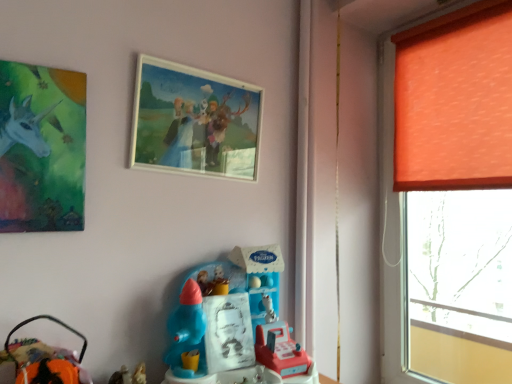
Question: From the image's perspective, is orange fabric curtain at right under velvet orange plush at lower left, which appears as the 1th toy when viewed from the left?

Choices:
 (A) no
 (B) yes

Answer: (A)

Question: From a real-world perspective, is orange fabric curtain at right physically below velvet orange plush at lower left, which appears as the 1th toy when viewed from the left?

Choices:
 (A) no
 (B) yes

Answer: (A)

Question: Can you confirm if orange fabric curtain at right is shorter than velvet orange plush at lower left, which appears as the 1th toy when viewed from the left?

Choices:
 (A) no
 (B) yes

Answer: (A)

Question: Does orange fabric curtain at right have a lesser width compared to velvet orange plush at lower left, which appears as the 1th toy when viewed from the left?

Choices:
 (A) no
 (B) yes

Answer: (B)

Question: Can you confirm if orange fabric curtain at right is bigger than velvet orange plush at lower left, positioned as the 2th toy in right-to-left order?

Choices:
 (A) no
 (B) yes

Answer: (B)

Question: Based on their positions, is matte green painting at upper left, which is counted as the 2th picture frame, starting from the right, located to the left or right of wooden picture frame at upper center, acting as the first picture frame starting from the back?

Choices:
 (A) left
 (B) right

Answer: (A)

Question: From their relative heights in the image, would you say matte green painting at upper left, which is counted as the 2th picture frame, starting from the right, is taller or shorter than wooden picture frame at upper center, acting as the first picture frame starting from the back?

Choices:
 (A) tall
 (B) short

Answer: (A)

Question: From a real-world perspective, relative to wooden picture frame at upper center, which ranks as the second picture frame in front-to-back order, is matte green painting at upper left, the first picture frame viewed from the left, vertically above or below?

Choices:
 (A) below
 (B) above

Answer: (A)

Question: Based on their sizes in the image, would you say matte green painting at upper left, placed as the 1th picture frame when sorted from front to back, is bigger or smaller than wooden picture frame at upper center, acting as the first picture frame starting from the back?

Choices:
 (A) small
 (B) big

Answer: (A)

Question: From the image's perspective, is plastic toy at center, marked as the 1th toy in a right-to-left arrangement, above or below orange fabric window at right?

Choices:
 (A) above
 (B) below

Answer: (B)

Question: Considering the positions of plastic toy at center, marked as the 1th toy in a right-to-left arrangement, and orange fabric window at right in the image, is plastic toy at center, marked as the 1th toy in a right-to-left arrangement, taller or shorter than orange fabric window at right?

Choices:
 (A) tall
 (B) short

Answer: (B)

Question: Does point (227, 269) appear closer or farther from the camera than point (468, 350)?

Choices:
 (A) farther
 (B) closer

Answer: (B)

Question: Choose the correct answer: Is plastic toy at center, marked as the 1th toy in a right-to-left arrangement, inside orange fabric window at right or outside it?

Choices:
 (A) inside
 (B) outside

Answer: (B)

Question: Looking at their shapes, would you say orange fabric curtain at right is wider or thinner than wooden picture frame at upper center, which ranks as the second picture frame in front-to-back order?

Choices:
 (A) wide
 (B) thin

Answer: (A)

Question: Would you say orange fabric curtain at right is inside or outside wooden picture frame at upper center, which ranks as the second picture frame in front-to-back order?

Choices:
 (A) inside
 (B) outside

Answer: (B)